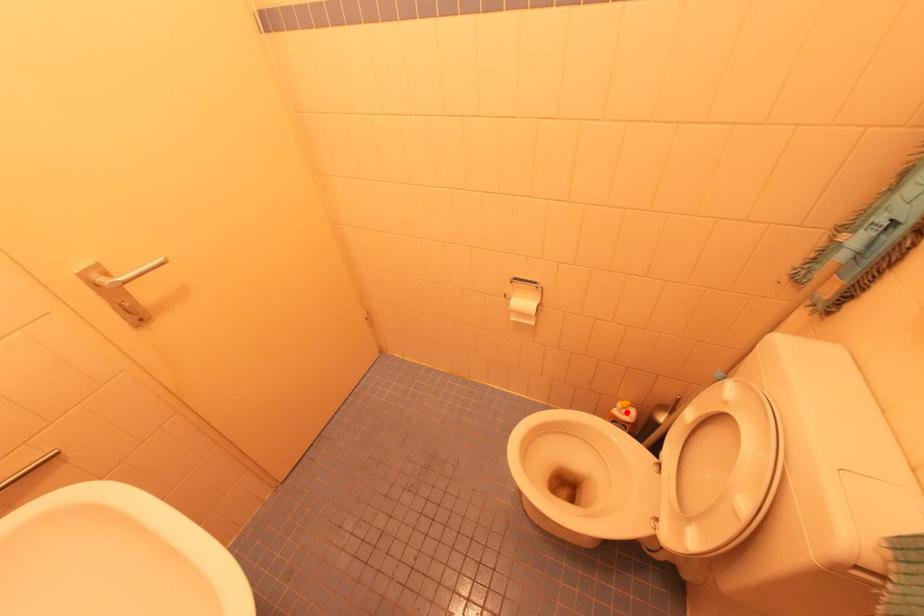
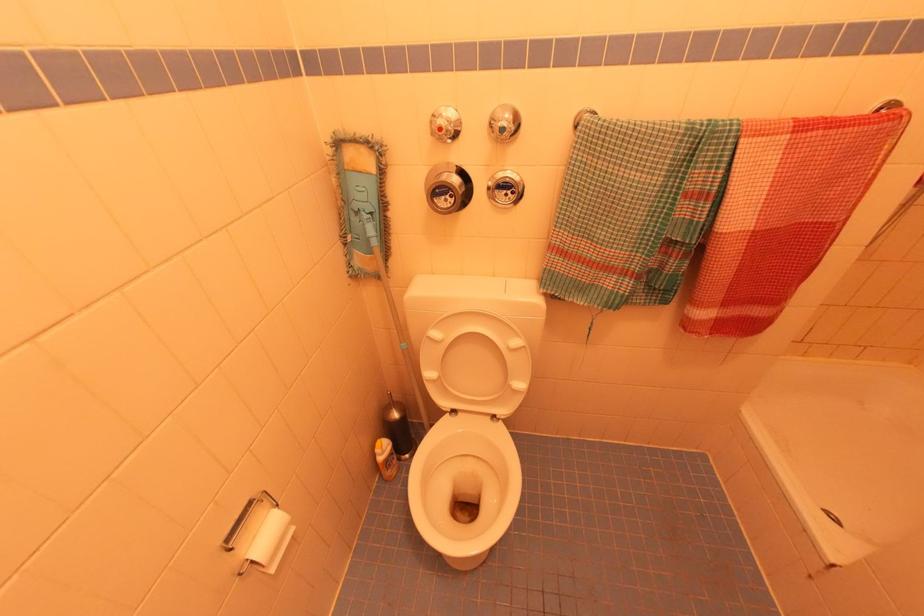
Question: A red point is marked in image1. In image2, is the corresponding 3D point closer to the camera or farther? Reply with the corresponding letter.

Choices:
 (A) The corresponding 3D point is closer.
 (B) The corresponding 3D point is farther.

Answer: (B)